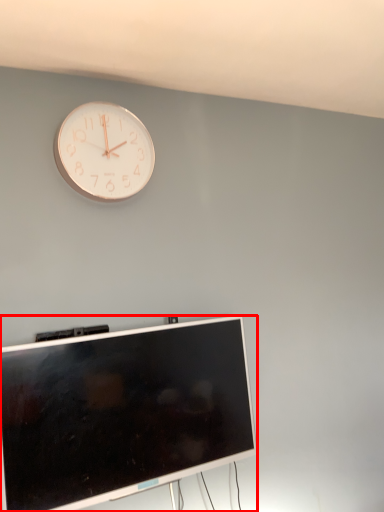
Question: Observing the image, what is the correct spatial positioning of television (annotated by the red box) in reference to wall clock?

Choices:
 (A) left
 (B) right

Answer: (B)